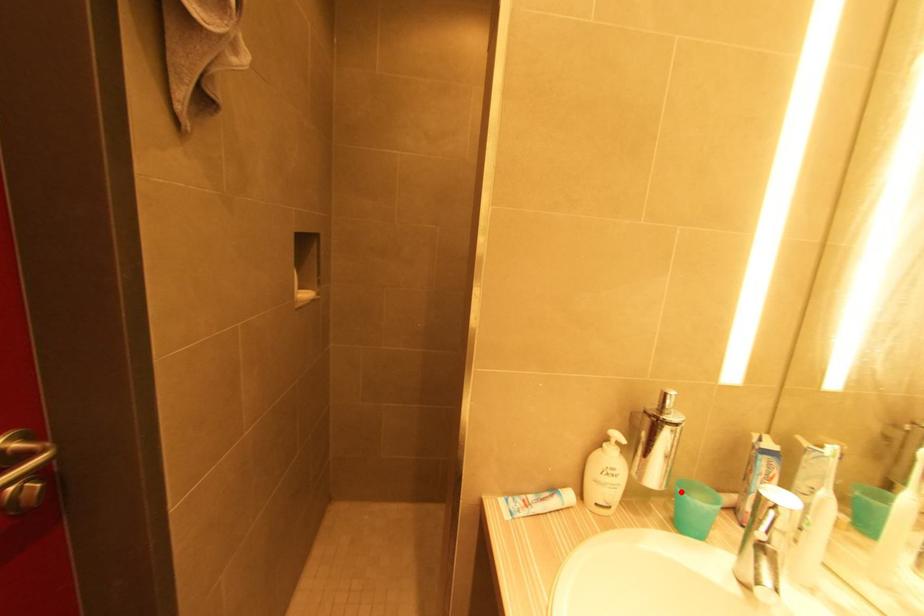
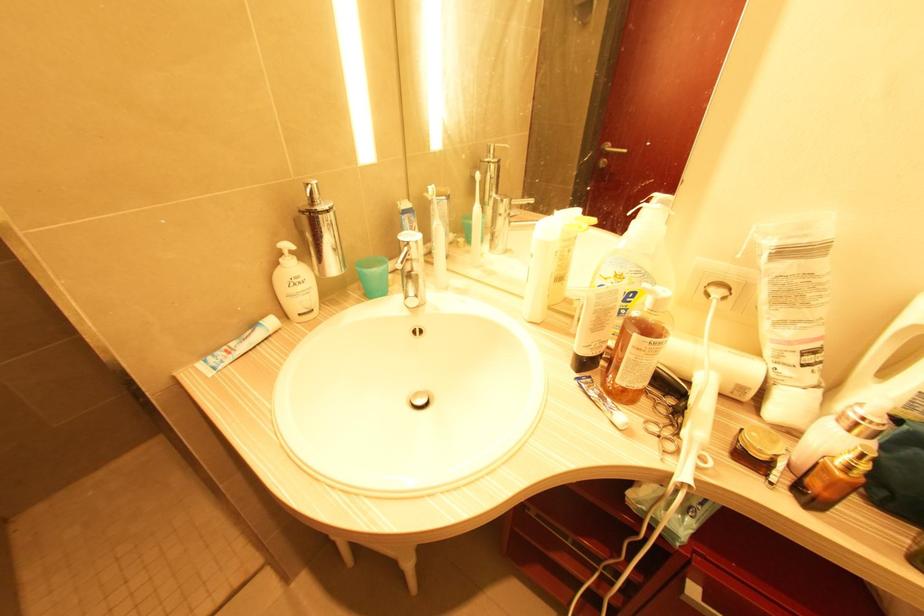
In the second image, find the point that corresponds to the highlighted location in the first image.

(359, 270)